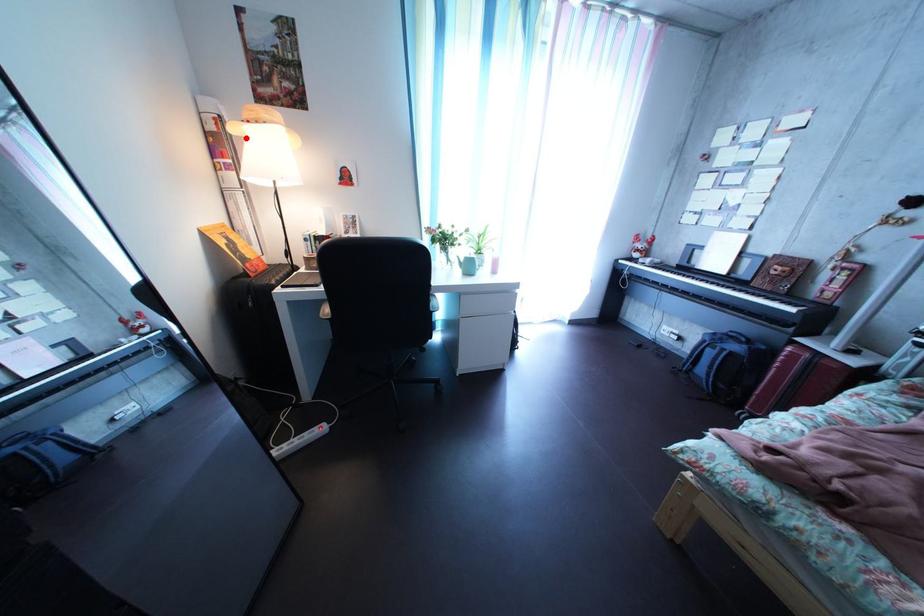
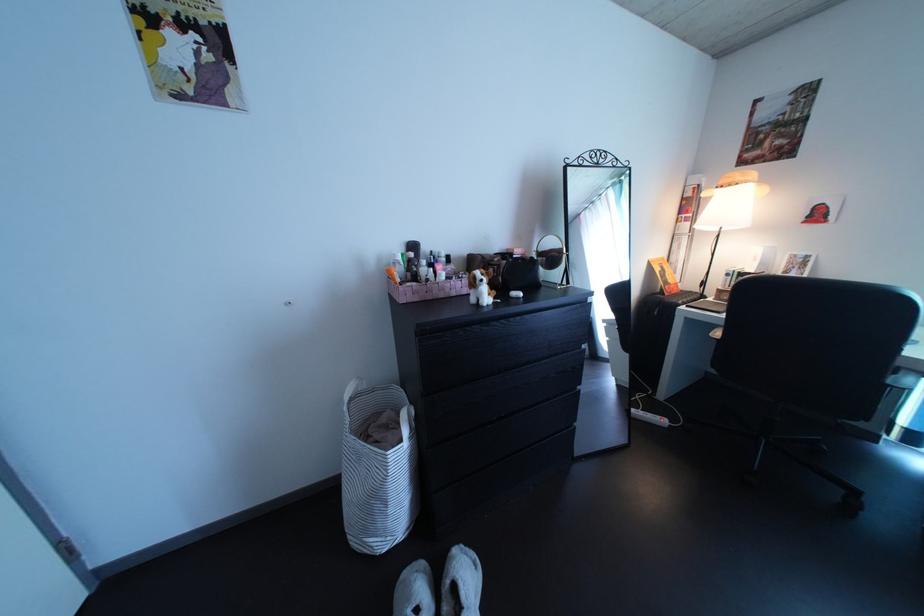
In the second image, find the point that corresponds to the highlighted location in the first image.

(719, 203)